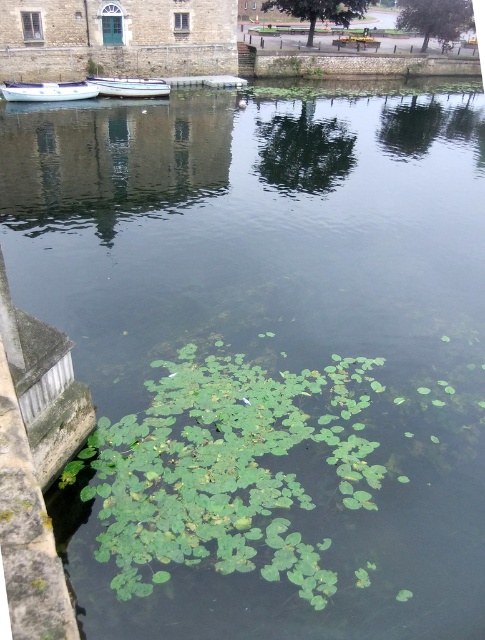
Question: Which of the following is the farthest from the observer?

Choices:
 (A) white glossy boat at center
 (B) white plastic boat at left

Answer: (A)

Question: Does white plastic boat at left have a smaller size compared to white glossy boat at center?

Choices:
 (A) no
 (B) yes

Answer: (B)

Question: Which of the following is the closest to the observer?

Choices:
 (A) (116, 90)
 (B) (23, 99)

Answer: (B)

Question: Which of the following is the closest to the observer?

Choices:
 (A) white glossy boat at center
 (B) white plastic boat at left

Answer: (B)

Question: Can you confirm if white plastic boat at left is smaller than white glossy boat at center?

Choices:
 (A) no
 (B) yes

Answer: (B)

Question: Is white plastic boat at left to the right of white glossy boat at center from the viewer's perspective?

Choices:
 (A) no
 (B) yes

Answer: (A)